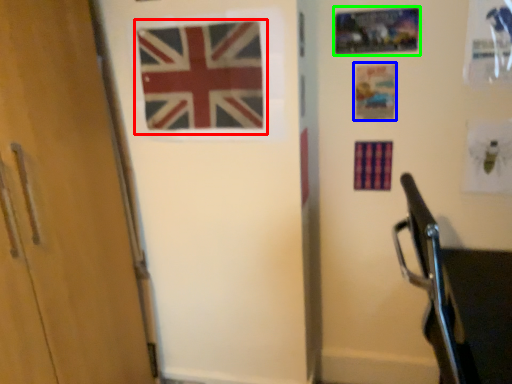
Question: Considering the real-world distances, which object is farthest from flag (highlighted by a red box)? postcard (highlighted by a blue box) or postcard (highlighted by a green box)?

Choices:
 (A) postcard
 (B) postcard

Answer: (A)